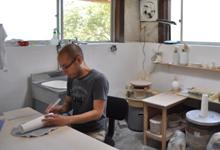
Locate an element on the screen. The image size is (220, 150). window sills is located at coordinates (37, 45), (210, 45).